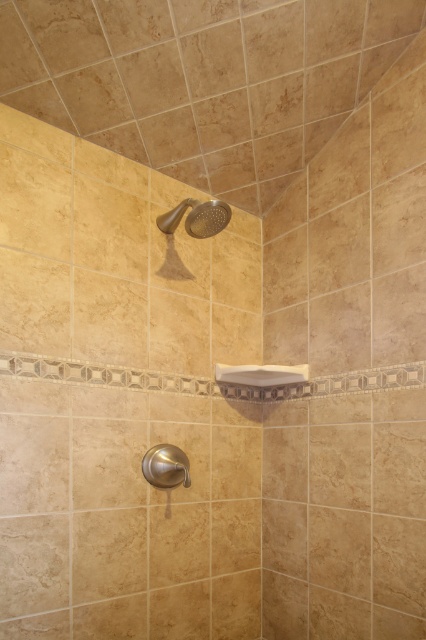
Who is shorter, matte gold showerhead at upper center or brushed metal shower handle at lower center?

matte gold showerhead at upper center is shorter.

How far apart are matte gold showerhead at upper center and brushed metal shower handle at lower center?

matte gold showerhead at upper center is 25.14 inches away from brushed metal shower handle at lower center.

Between point (192, 212) and point (181, 456), which one is positioned in front?

Point (192, 212)

Locate an element on the screen. This screenshot has width=426, height=640. matte gold showerhead at upper center is located at coordinates [196, 218].